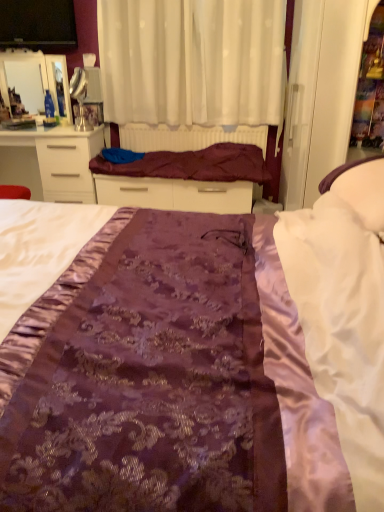
Question: From the image's perspective, is white sheer curtain at upper center over purple satin bed at center?

Choices:
 (A) yes
 (B) no

Answer: (A)

Question: Could you tell me if white sheer curtain at upper center is facing purple satin bed at center?

Choices:
 (A) yes
 (B) no

Answer: (A)

Question: Does white sheer curtain at upper center have a larger size compared to purple satin bed at center?

Choices:
 (A) no
 (B) yes

Answer: (A)

Question: Can you confirm if white sheer curtain at upper center is positioned to the left of purple satin bed at center?

Choices:
 (A) yes
 (B) no

Answer: (B)

Question: Would you say white sheer curtain at upper center is a long distance from purple satin bed at center?

Choices:
 (A) yes
 (B) no

Answer: (A)

Question: Can you confirm if white sheer curtain at upper center is thinner than purple satin bed at center?

Choices:
 (A) yes
 (B) no

Answer: (A)

Question: From a real-world perspective, is matte black tv at upper left beneath maroon satin blanket at center?

Choices:
 (A) no
 (B) yes

Answer: (A)

Question: Can you confirm if matte black tv at upper left is positioned to the left of maroon satin blanket at center?

Choices:
 (A) yes
 (B) no

Answer: (A)

Question: Is matte black tv at upper left at the right side of maroon satin blanket at center?

Choices:
 (A) no
 (B) yes

Answer: (A)

Question: Is matte black tv at upper left directly adjacent to maroon satin blanket at center?

Choices:
 (A) yes
 (B) no

Answer: (B)

Question: Is matte black tv at upper left wider than maroon satin blanket at center?

Choices:
 (A) yes
 (B) no

Answer: (B)

Question: Is matte black tv at upper left behind maroon satin blanket at center?

Choices:
 (A) yes
 (B) no

Answer: (A)

Question: Would you say matte black tv at upper left is outside purple satin bed frame at center?

Choices:
 (A) no
 (B) yes

Answer: (B)